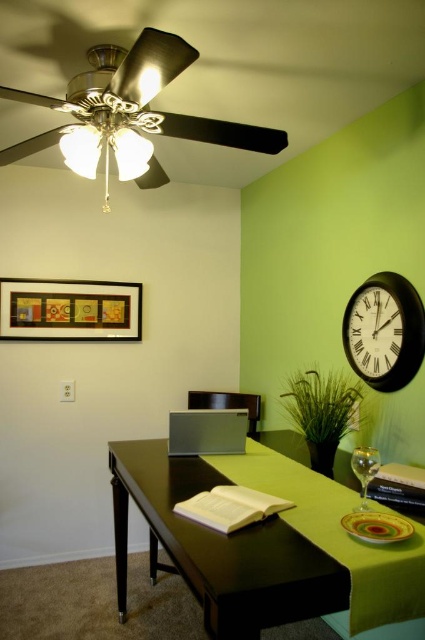
You are sitting at the black glossy table at center and want to reach for the transparent glass wine glass at center. Is the wine glass within easy reach from your current position?

The black glossy table at center is closer to the viewer than transparent glass wine glass at center, so the wine glass is farther away and may not be within easy reach. You might need to extend your arm or adjust your position to reach it.